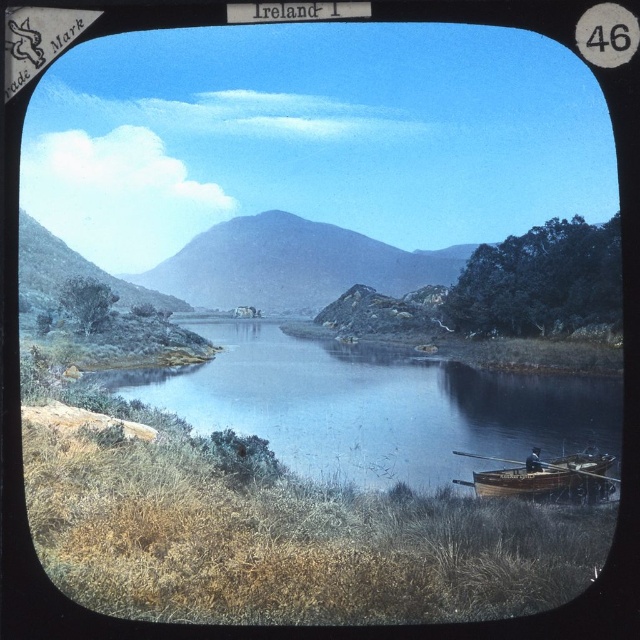
You are planning to launch a small kayak from the wooden canoe at lower right into the blue smooth water at center. Based on the scene, do you think the water is wide enough for the kayak to maneuver safely?

The blue smooth water at center might be wider than wooden canoe at lower right, so there is a possibility that the water is wide enough for the kayak to maneuver safely, but there is uncertainty due to the description using the word might.

You are planning to take a photo of the blue smooth water at center and the wooden canoe at lower right. Which object should you focus on first if you want to capture both in a single shot without moving the camera?

The blue smooth water at center is larger in size than the wooden canoe at lower right, so you should focus on the blue smooth water at center first to ensure it fits within the frame before adjusting for the smaller wooden canoe at lower right.